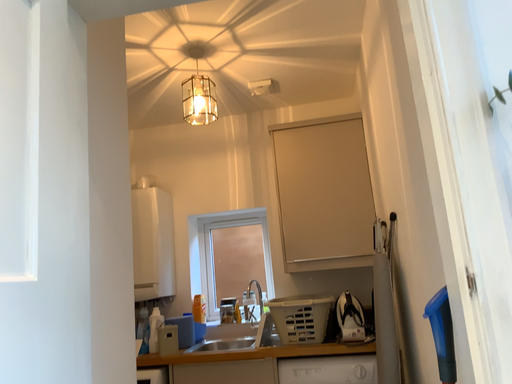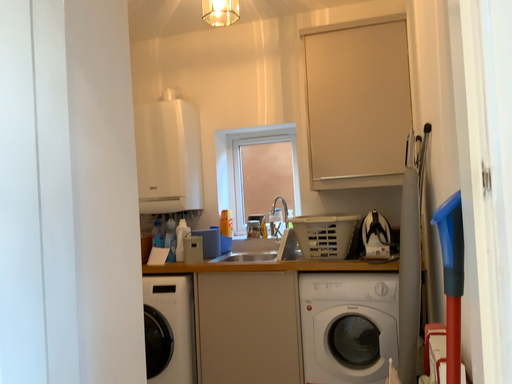
Question: Which way did the camera rotate in the video?

Choices:
 (A) rotated upward
 (B) rotated downward

Answer: (B)